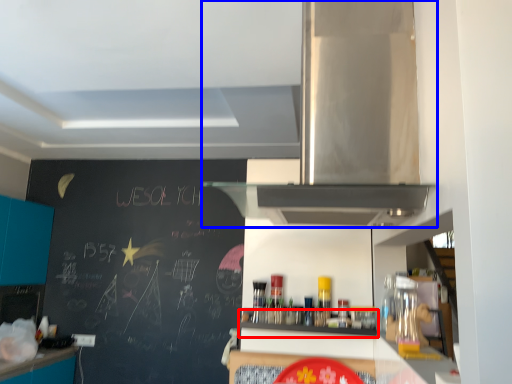
Question: Which point is closer to the camera, shelf (highlighted by a red box) or home appliance (highlighted by a blue box)?

Choices:
 (A) shelf
 (B) home appliance

Answer: (B)